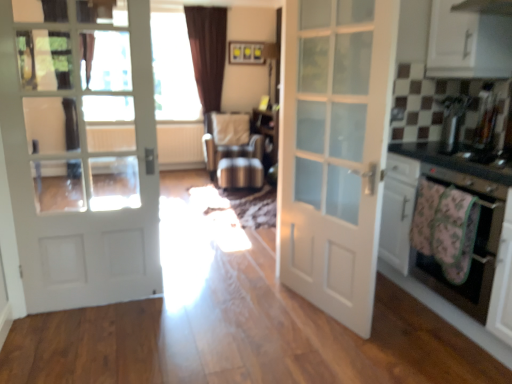
Measure the distance between point (440, 101) and camera.

They are 2.83 meters apart.

Describe the element at coordinates (474, 245) in the screenshot. This screenshot has height=384, width=512. I see `pink fabric oven at right` at that location.

Image resolution: width=512 pixels, height=384 pixels. I want to click on white glossy cabinet at upper right, so click(468, 43).

The width and height of the screenshot is (512, 384). What do you see at coordinates (81, 150) in the screenshot?
I see `white glass door at left, positioned as the second door in right-to-left order` at bounding box center [81, 150].

This screenshot has width=512, height=384. In order to click on white matte door at center, the 2th door from the left in this screenshot , I will do (x=334, y=151).

This screenshot has height=384, width=512. In order to click on satin silver toaster at upper right in this screenshot , I will do `click(452, 121)`.

The width and height of the screenshot is (512, 384). I want to click on blanket on the right side of transparent glass door at upper center, so click(x=455, y=233).

Which is closer to the camera, [474,202] or [167,13]?

Positioned in front is point [474,202].

Which of these two, fluffy floral blanket at lower right or transparent glass door at upper center, is smaller?

fluffy floral blanket at lower right.

Does point (202, 148) come in front of point (240, 146)?

No.

Which is correct: white textured radiator at center is inside metallic silver chair at center, or outside of it?

The correct answer is: outside.

Is white textured radiator at center facing away from metallic silver chair at center?

That's not correct — white textured radiator at center is not looking away from metallic silver chair at center.

Considering the sizes of objects white textured radiator at center and metallic silver chair at center in the image provided, who is bigger, white textured radiator at center or metallic silver chair at center?

Bigger between the two is metallic silver chair at center.

How far apart are transparent glass door at upper center and pink fabric oven at right?

transparent glass door at upper center and pink fabric oven at right are 4.16 meters apart.

From a real-world perspective, relative to pink fabric oven at right, is transparent glass door at upper center vertically above or below?

transparent glass door at upper center is situated higher than pink fabric oven at right in the real world.

What's the angular difference between transparent glass door at upper center and pink fabric oven at right's facing directions?

They differ by 92 degrees in their facing directions.

Is transparent glass door at upper center wider or thinner than pink fabric oven at right?

Clearly, transparent glass door at upper center has less width compared to pink fabric oven at right.

Can you confirm if black glossy countertop at right is positioned to the right of pink fabric oven at right?

Yes, black glossy countertop at right is to the right of pink fabric oven at right.

From the image's perspective, which is above, black glossy countertop at right or pink fabric oven at right?

black glossy countertop at right, from the image's perspective.

Is pink fabric oven at right inside black glossy countertop at right?

Definitely not — pink fabric oven at right is not inside black glossy countertop at right.

Which is closer, (405, 148) or (481, 287)?

Point (405, 148) appears to be farther away from the viewer than point (481, 287).

Is fluffy floral blanket at lower right inside the boundaries of black glossy countertop at right, or outside?

fluffy floral blanket at lower right is outside black glossy countertop at right.

Where is `blanket behind the black glossy countertop at right`? The width and height of the screenshot is (512, 384). blanket behind the black glossy countertop at right is located at coordinates (455, 233).

Can you confirm if fluffy floral blanket at lower right is positioned to the left of black glossy countertop at right?

Correct, you'll find fluffy floral blanket at lower right to the left of black glossy countertop at right.

Can you tell me how much white glass door at left, positioned as the first door in left-to-right order, and pink fabric oven at right differ in facing direction?

The angle between the facing direction of white glass door at left, positioned as the first door in left-to-right order, and the facing direction of pink fabric oven at right is 92 degrees.

Is white glass door at left, positioned as the second door in right-to-left order, positioned before pink fabric oven at right?

No, white glass door at left, positioned as the second door in right-to-left order, is further to the viewer.

Does white glass door at left, positioned as the second door in right-to-left order, appear on the left side of pink fabric oven at right?

Yes.

Considering the relative sizes of white glass door at left, positioned as the second door in right-to-left order, and pink fabric oven at right in the image provided, is white glass door at left, positioned as the second door in right-to-left order, shorter than pink fabric oven at right?

No, white glass door at left, positioned as the second door in right-to-left order, is not shorter than pink fabric oven at right.

Considering the positions of objects transparent glass door at upper center and metallic silver chair at center in the image provided, who is more to the left, transparent glass door at upper center or metallic silver chair at center?

Positioned to the left is transparent glass door at upper center.

Could you tell me if transparent glass door at upper center is facing metallic silver chair at center?

No, transparent glass door at upper center is not turned towards metallic silver chair at center.

Considering the points (170, 46) and (242, 175), which point is in front, point (170, 46) or point (242, 175)?

The point (242, 175) is closer to the camera.

Considering the sizes of objects transparent glass door at upper center and metallic silver chair at center in the image provided, who is taller, transparent glass door at upper center or metallic silver chair at center?

With more height is transparent glass door at upper center.

Image resolution: width=512 pixels, height=384 pixels. What are the coordinates of `blanket on the right of transparent glass door at upper center` in the screenshot? It's located at (455, 233).

Locate an element on the screen. The width and height of the screenshot is (512, 384). radiator on the left side of metallic silver chair at center is located at coordinates (180, 145).

From the image, which object appears to be farther from metallic silver chair at center, white matte door at center, the 2th door from the left, or white glossy cabinet at upper right?

white glossy cabinet at upper right lies further to metallic silver chair at center than the other object.

Estimate the real-world distances between objects in this image. Which object is further from fluffy floral blanket at lower right, metallic silver chair at center or transparent glass door at upper center?

Among the two, transparent glass door at upper center is located further to fluffy floral blanket at lower right.

Considering their positions, is satin silver toaster at upper right positioned further to white textured radiator at center than white matte door at center, the 2th door from the left?

satin silver toaster at upper right lies further to white textured radiator at center than the other object.

From the image, which object appears to be nearer to satin silver toaster at upper right, white textured radiator at center or metallic silver chair at center?

The object closer to satin silver toaster at upper right is metallic silver chair at center.

Which object lies nearer to the anchor point satin silver toaster at upper right, pink fabric oven at right or white textured radiator at center?

pink fabric oven at right lies closer to satin silver toaster at upper right than the other object.

When comparing their distances from metallic silver chair at center, does black glossy countertop at right or satin silver toaster at upper right seem closer?

satin silver toaster at upper right.

Which object lies nearer to the anchor point white glass door at left, positioned as the second door in right-to-left order, white matte door at center, which is the 1th door from right to left, or black glossy countertop at right?

Among the two, white matte door at center, which is the 1th door from right to left, is located nearer to white glass door at left, positioned as the second door in right-to-left order.

Looking at the image, which one is located further to black glossy countertop at right, white matte door at center, which is the 1th door from right to left, or white glossy cabinet at upper right?

Among the two, white glossy cabinet at upper right is located further to black glossy countertop at right.

At what (x,y) coordinates should I click in order to perform the action: click on appliance between white glossy cabinet at upper right and pink fabric oven at right from top to bottom. Please return your answer as a coordinate pair (x, y). Looking at the image, I should click on (452, 121).

You are a GUI agent. You are given a task and a screenshot of the screen. Output one action in this format:
    pyautogui.click(x=<x>, y=<y>)
    Task: Click on the blanket between white glass door at left, positioned as the second door in right-to-left order, and satin silver toaster at upper right
    
    Given the screenshot: What is the action you would take?
    pyautogui.click(x=455, y=233)

The image size is (512, 384). I want to click on window screen between white glass door at left, positioned as the first door in left-to-right order, and metallic silver chair at center in the front-back direction, so click(173, 69).

Find the location of a particular element. Image resolution: width=512 pixels, height=384 pixels. cabinetry between black glossy countertop at right and transparent glass door at upper center along the z-axis is located at coordinates (468, 43).